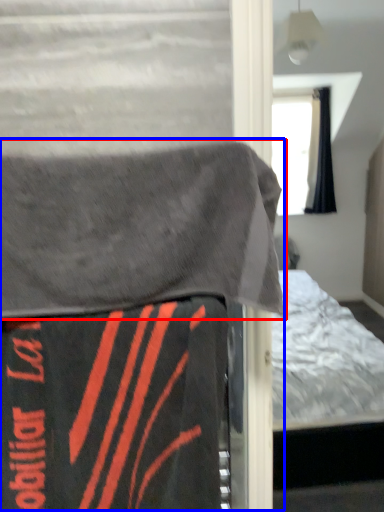
Question: Which object appears farthest to the camera in this image, blanket (highlighted by a red box) or bed (highlighted by a blue box)?

Choices:
 (A) blanket
 (B) bed

Answer: (B)